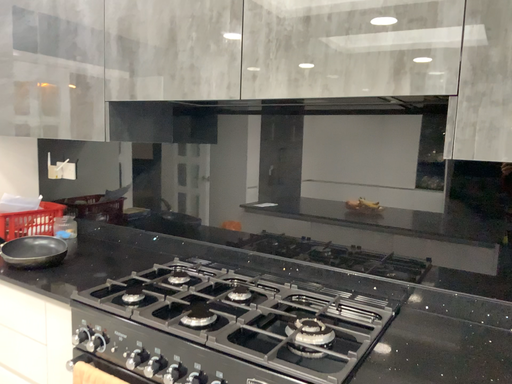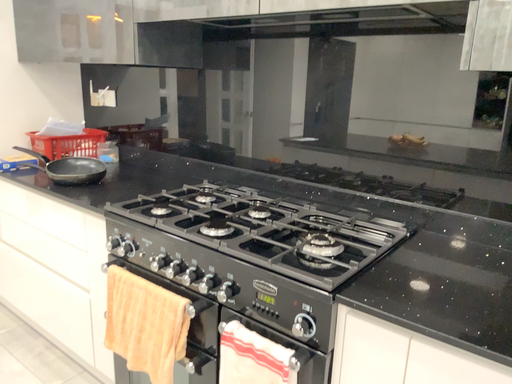
Question: How did the camera likely rotate when shooting the video?

Choices:
 (A) rotated upward
 (B) rotated downward

Answer: (B)